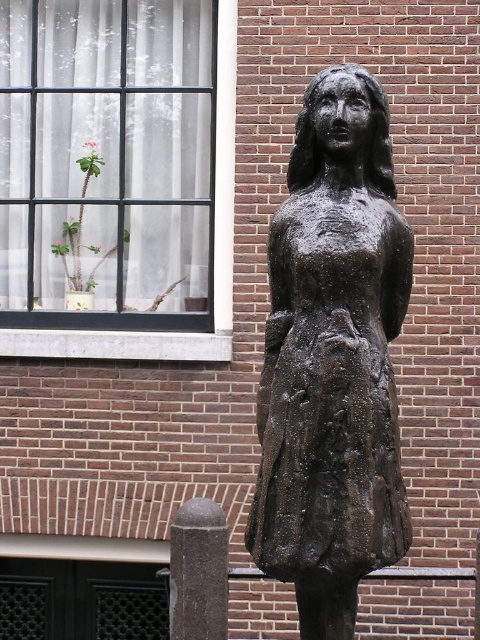
Does bronze statue at center have a lesser height compared to white sheer curtain at upper left?

No.

Does bronze statue at center appear under white sheer curtain at upper left?

Yes, bronze statue at center is below white sheer curtain at upper left.

Does point (380, 342) come behind point (86, 337)?

No, (380, 342) is in front of (86, 337).

This screenshot has width=480, height=640. In order to click on bronze statue at center in this screenshot , I will do `click(333, 358)`.